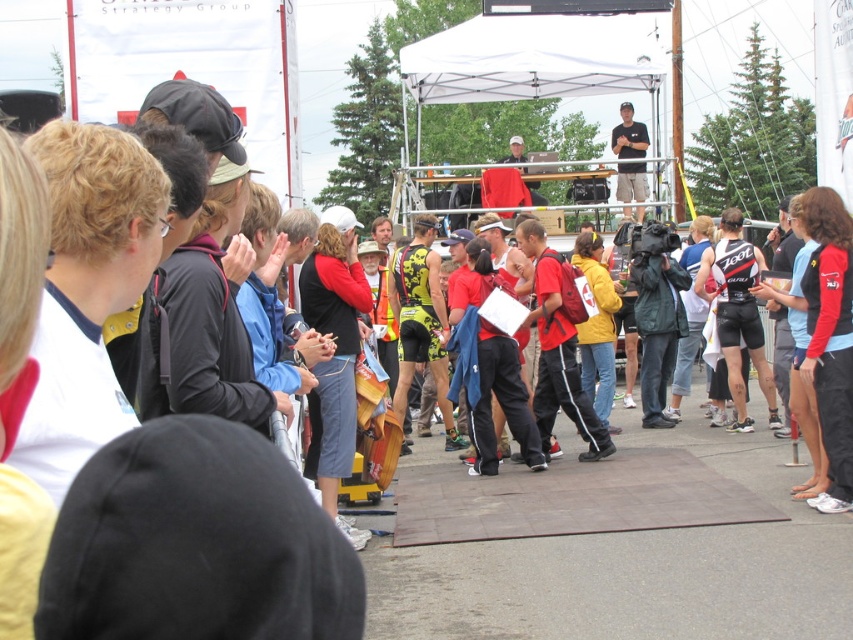
Question: Which point is closer to the camera?

Choices:
 (A) white fabric canopy at upper center
 (B) black matte shirt at upper center

Answer: (A)

Question: Can you confirm if white fabric canopy at upper center is thinner than black matte shirt at upper center?

Choices:
 (A) no
 (B) yes

Answer: (A)

Question: Does white fabric canopy at upper center appear over black matte shirt at upper center?

Choices:
 (A) yes
 (B) no

Answer: (A)

Question: Which point appears farthest from the camera in this image?

Choices:
 (A) (456, 84)
 (B) (624, 145)

Answer: (B)

Question: Considering the relative positions of white fabric canopy at upper center and black matte shirt at upper center in the image provided, where is white fabric canopy at upper center located with respect to black matte shirt at upper center?

Choices:
 (A) below
 (B) above

Answer: (B)